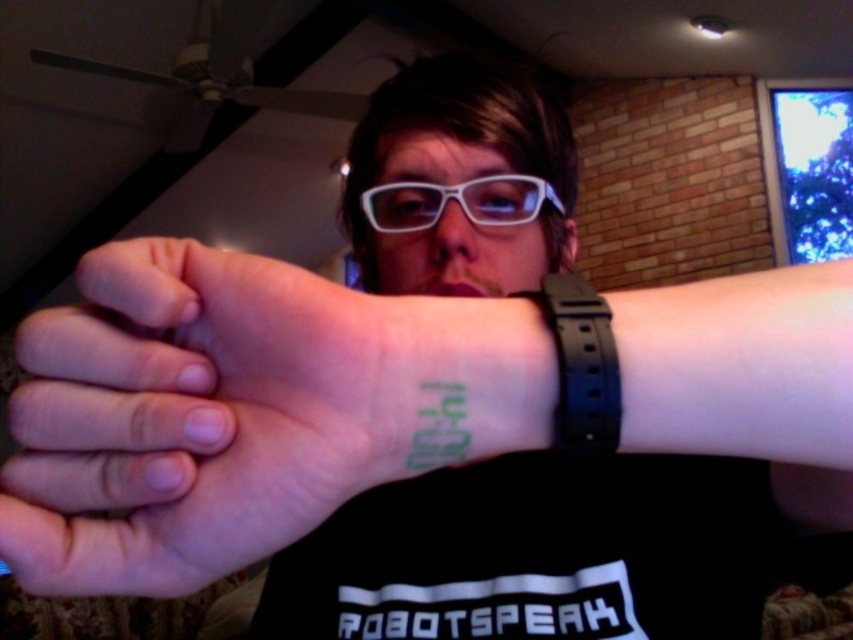
At what (x,y) coordinates should I click in order to perform the action: click on black rubber wristband at upper right. Please return your answer as a coordinate pair (x, y). Looking at the image, I should click on (581, 364).

Who is more forward, (x=572, y=348) or (x=396, y=230)?

Point (x=572, y=348) is in front.

Where is `black rubber wristband at upper right`? black rubber wristband at upper right is located at coordinates (581, 364).

Image resolution: width=853 pixels, height=640 pixels. I want to click on black rubber wristband at upper right, so click(x=581, y=364).

Is point (218, 545) positioned before point (583, 330)?

Yes, point (218, 545) is in front of point (583, 330).

Looking at this image, is green ink tattoo at center wider than black rubber wristband at upper right?

Yes, green ink tattoo at center is wider than black rubber wristband at upper right.

Find the location of a particular element. The image size is (853, 640). green ink tattoo at center is located at coordinates (242, 410).

At what (x,y) coordinates should I click in order to perform the action: click on green ink tattoo at center. Please return your answer as a coordinate pair (x, y). The width and height of the screenshot is (853, 640). Looking at the image, I should click on (242, 410).

Who is positioned more to the left, green ink tattoo at center or white matte glasses at center?

green ink tattoo at center

How far apart are green ink tattoo at center and white matte glasses at center?

green ink tattoo at center is 9.01 inches from white matte glasses at center.

In order to click on green ink tattoo at center in this screenshot , I will do `click(242, 410)`.